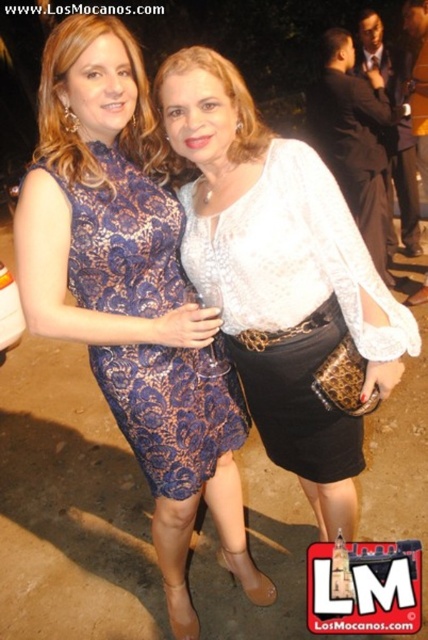
From the picture: You are a photographer standing at point (x=315, y=472). You need to capture a photo of both women clearly. Considering their current distance apart, is it possible to frame them both within a standard camera lens with a 50mm focal length without cropping? Explain your reasoning.

The two women are 1.86 meters apart. A standard 50mm lens has a field of view wide enough to capture subjects about 1.8 meters apart at a typical shooting distance. Therefore, it should be possible to frame both women within the lens without cropping.

You are a photographer trying to capture the best shot of the two women at the event. You notice a specific point at coordinates point (279, 275). Which object from the scene does this point lie on?

The point (279, 275) is on the white lace blouse at center.